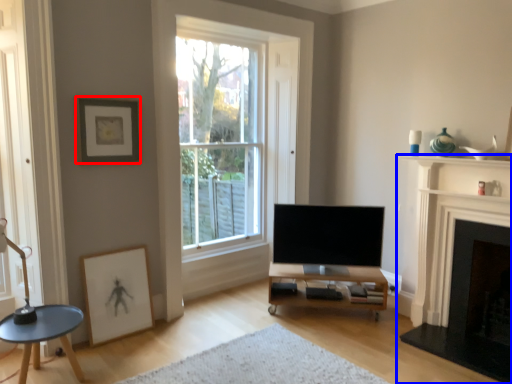
Question: Which object appears farthest to the camera in this image, picture frame (highlighted by a red box) or fireplace (highlighted by a blue box)?

Choices:
 (A) picture frame
 (B) fireplace

Answer: (A)